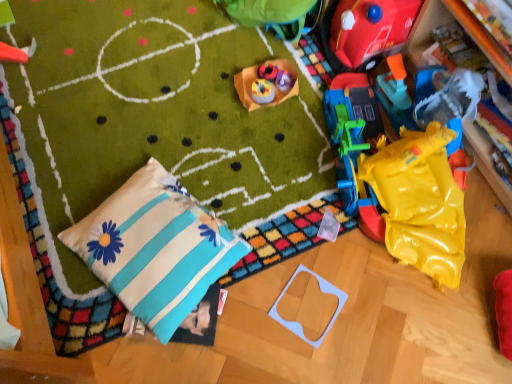
What do you see at coordinates (366, 31) in the screenshot? I see `rubberized red car at upper right, which is the fifth toy in bottom-to-top order` at bounding box center [366, 31].

What is the approximate width of rubberized red car at upper right, which is the 2th toy from top to bottom?

12.20 inches.

What do you see at coordinates (270, 15) in the screenshot?
I see `green fabric tent at upper center, the 4th toy from the left` at bounding box center [270, 15].

What do you see at coordinates (298, 323) in the screenshot? I see `light blue plastic frame at lower center, the 6th toy in the top-to-bottom sequence` at bounding box center [298, 323].

The image size is (512, 384). Find the location of `matte plastic toy at center, placed as the 5th toy when sorted from right to left`. matte plastic toy at center, placed as the 5th toy when sorted from right to left is located at coordinates 262,91.

You are a GUI agent. You are given a task and a screenshot of the screen. Output one action in this format:
    pyautogui.click(x=<x>, y=<y>)
    Task: Click on the yellow rubber at right
    
    Given the screenshot: What is the action you would take?
    pyautogui.click(x=419, y=201)

Between light blue plastic frame at lower center, placed as the fifth toy when sorted from left to right, and cotton/pillow at lower left, which one has less height?

Standing shorter between the two is light blue plastic frame at lower center, placed as the fifth toy when sorted from left to right.

From the image's perspective, is light blue plastic frame at lower center, which is the second toy from right to left, on cotton/pillow at lower left?

No, from the image's perspective, light blue plastic frame at lower center, which is the second toy from right to left, is not above cotton/pillow at lower left.

Is point (296, 274) closer or farther from the camera than point (163, 335)?

Point (296, 274) is farther from the camera than point (163, 335).

Is light blue plastic frame at lower center, which is the second toy from right to left, beside rubberized red toy at upper left, which ranks as the sixth toy in right-to-left order?

light blue plastic frame at lower center, which is the second toy from right to left, and rubberized red toy at upper left, which ranks as the sixth toy in right-to-left order, are not in contact.

From the image's perspective, relative to rubberized red toy at upper left, which appears as the first toy when viewed from the left, is light blue plastic frame at lower center, which ranks as the first toy in bottom-to-top order, above or below?

light blue plastic frame at lower center, which ranks as the first toy in bottom-to-top order, is below rubberized red toy at upper left, which appears as the first toy when viewed from the left.

Is light blue plastic frame at lower center, placed as the fifth toy when sorted from left to right, bigger than rubberized red toy at upper left, which ranks as the sixth toy in right-to-left order?

Incorrect, light blue plastic frame at lower center, placed as the fifth toy when sorted from left to right, is not larger than rubberized red toy at upper left, which ranks as the sixth toy in right-to-left order.

From a real-world perspective, is matte plastic toy at center, positioned as the fourth toy in right-to-left order, on top of green fabric tent at upper center, the 4th toy from the left?

Actually, matte plastic toy at center, positioned as the fourth toy in right-to-left order, is physically below green fabric tent at upper center, the 4th toy from the left, in the real world.

This screenshot has width=512, height=384. Find the location of `the 1st toy to the left of the green fabric tent at upper center, arranged as the sixth toy when ordered from the bottom, starting your count from the anchor`. the 1st toy to the left of the green fabric tent at upper center, arranged as the sixth toy when ordered from the bottom, starting your count from the anchor is located at coordinates (266, 84).

Is matte plastic toy at center, which is the fourth toy in top-to-bottom order, looking in the opposite direction of green fabric tent at upper center, which appears as the first toy when viewed from the top?

matte plastic toy at center, which is the fourth toy in top-to-bottom order, is not turned away from green fabric tent at upper center, which appears as the first toy when viewed from the top.

Considering the relative positions of matte plastic toy at center, positioned as the fourth toy in right-to-left order, and green fabric tent at upper center, the 3th toy viewed from the right, in the image provided, is matte plastic toy at center, positioned as the fourth toy in right-to-left order, to the left or to the right of green fabric tent at upper center, the 3th toy viewed from the right,?

In the image, matte plastic toy at center, positioned as the fourth toy in right-to-left order, appears on the left side of green fabric tent at upper center, the 3th toy viewed from the right.

Is cotton/pillow at lower left oriented away from yellow rubber at right?

No, cotton/pillow at lower left is not facing the opposite direction of yellow rubber at right.

Is cotton/pillow at lower left wider or thinner than yellow rubber at right?

In the image, cotton/pillow at lower left appears to be wider than yellow rubber at right.

Is yellow rubber at right located within cotton/pillow at lower left?

No, yellow rubber at right is located outside of cotton/pillow at lower left.

In the scene shown: Is the depth of matte plastic toy at center, placed as the 5th toy when sorted from right to left, greater than that of matte plastic toy at center, which ranks as the 3th toy in bottom-to-top order?

Yes, matte plastic toy at center, placed as the 5th toy when sorted from right to left, is behind matte plastic toy at center, which ranks as the 3th toy in bottom-to-top order.

What are the coordinates of `toy that is the 1st one when counting rightward from the matte plastic toy at center, the 2th toy in the left-to-right sequence` in the screenshot? It's located at (266, 84).

Is matte plastic toy at center, the 2th toy in the left-to-right sequence, not near matte plastic toy at center, which is the fourth toy in top-to-bottom order?

No, there isn't a large distance between matte plastic toy at center, the 2th toy in the left-to-right sequence, and matte plastic toy at center, which is the fourth toy in top-to-bottom order.

Does matte plastic toy at center, which is the fifth toy from top to bottom, have a greater width compared to matte plastic toy at center, positioned as the fourth toy in right-to-left order?

No.

Does cotton/pillow at lower left touch rubberized red toy at upper left, positioned as the 4th toy in bottom-to-top order?

No, cotton/pillow at lower left is not in contact with rubberized red toy at upper left, positioned as the 4th toy in bottom-to-top order.

Is cotton/pillow at lower left thinner than rubberized red toy at upper left, which appears as the first toy when viewed from the left?

Incorrect, the width of cotton/pillow at lower left is not less than that of rubberized red toy at upper left, which appears as the first toy when viewed from the left.

Identify the location of pillow that is in front of the rubberized red toy at upper left, which ranks as the sixth toy in right-to-left order. (155, 248).

From the image's perspective, is rubberized red car at upper right, arranged as the first toy when viewed from the right, beneath cotton/pillow at lower left?

Incorrect, from the image's perspective, rubberized red car at upper right, arranged as the first toy when viewed from the right, is higher than cotton/pillow at lower left.

In the scene shown: Is rubberized red car at upper right, which is the fifth toy in bottom-to-top order, not near cotton/pillow at lower left?

That's not correct — rubberized red car at upper right, which is the fifth toy in bottom-to-top order, is a little close to cotton/pillow at lower left.

Is rubberized red car at upper right, which is the fifth toy in bottom-to-top order, taller than cotton/pillow at lower left?

Yes.

From the cotton/pillow at lower left, count 4th toy to the right and point to it. Please provide its 2D coordinates.

[(298, 323)]

Which toy is the 4th one when counting from the back of the light blue plastic frame at lower center, placed as the fifth toy when sorted from left to right? Please provide its 2D coordinates.

[(12, 54)]

Looking at the image, which one is located closer to cotton/pillow at lower left, matte plastic toy at center, the 2th toy in the left-to-right sequence, or rubberized red toy at upper left, which appears as the first toy when viewed from the left?

matte plastic toy at center, the 2th toy in the left-to-right sequence.

Estimate the real-world distances between objects in this image. Which object is further from light blue plastic frame at lower center, which is the second toy from right to left, rubberized red toy at upper left, the third toy in the top-to-bottom sequence, or rubberized red car at upper right, which is the fifth toy in bottom-to-top order?

rubberized red toy at upper left, the third toy in the top-to-bottom sequence, is positioned further to the anchor light blue plastic frame at lower center, which is the second toy from right to left.

Considering their positions, is green fabric tent at upper center, the 3th toy viewed from the right, positioned further to cotton/pillow at lower left than yellow rubber at right?

green fabric tent at upper center, the 3th toy viewed from the right, is positioned further to the anchor cotton/pillow at lower left.

Looking at the image, which one is located further to light blue plastic frame at lower center, the 6th toy in the top-to-bottom sequence, rubberized red toy at upper left, which appears as the first toy when viewed from the left, or matte plastic toy at center, the 2th toy ordered from the bottom?

Based on the image, rubberized red toy at upper left, which appears as the first toy when viewed from the left, appears to be further to light blue plastic frame at lower center, the 6th toy in the top-to-bottom sequence.

From the image, which object appears to be farther from cotton/pillow at lower left, yellow rubber at right or rubberized red toy at upper left, which ranks as the sixth toy in right-to-left order?

rubberized red toy at upper left, which ranks as the sixth toy in right-to-left order.

Consider the image. Looking at the image, which one is located closer to rubberized red car at upper right, which ranks as the sixth toy in left-to-right order, matte plastic toy at center, the 2th toy in the left-to-right sequence, or matte plastic toy at center, which is the fourth toy in top-to-bottom order?

matte plastic toy at center, which is the fourth toy in top-to-bottom order, is positioned closer to the anchor rubberized red car at upper right, which ranks as the sixth toy in left-to-right order.

From the image, which object appears to be nearer to yellow rubber at right, matte plastic toy at center, which is the 3th toy from left to right, or rubberized red toy at upper left, which ranks as the sixth toy in right-to-left order?

The object closer to yellow rubber at right is matte plastic toy at center, which is the 3th toy from left to right.

Which object lies further to the anchor point matte plastic toy at center, the 2th toy in the left-to-right sequence, rubberized red car at upper right, which ranks as the sixth toy in left-to-right order, or light blue plastic frame at lower center, which is the second toy from right to left?

Among the two, light blue plastic frame at lower center, which is the second toy from right to left, is located further to matte plastic toy at center, the 2th toy in the left-to-right sequence.

I want to click on bean bag chair between green fabric tent at upper center, arranged as the sixth toy when ordered from the bottom, and cotton/pillow at lower left from top to bottom, so click(419, 201).

This screenshot has height=384, width=512. Identify the location of toy between matte plastic toy at center, which ranks as the 3th toy in bottom-to-top order, and light blue plastic frame at lower center, which ranks as the first toy in bottom-to-top order, from top to bottom. (262, 91).

At what (x,y) coordinates should I click in order to perform the action: click on pillow between rubberized red toy at upper left, the third toy in the top-to-bottom sequence, and yellow rubber at right from left to right. Please return your answer as a coordinate pair (x, y). This screenshot has height=384, width=512. Looking at the image, I should click on (155, 248).

Find the location of `pillow that lies between rubberized red car at upper right, which is the 2th toy from top to bottom, and light blue plastic frame at lower center, which ranks as the first toy in bottom-to-top order, from top to bottom`. pillow that lies between rubberized red car at upper right, which is the 2th toy from top to bottom, and light blue plastic frame at lower center, which ranks as the first toy in bottom-to-top order, from top to bottom is located at coordinates (155, 248).